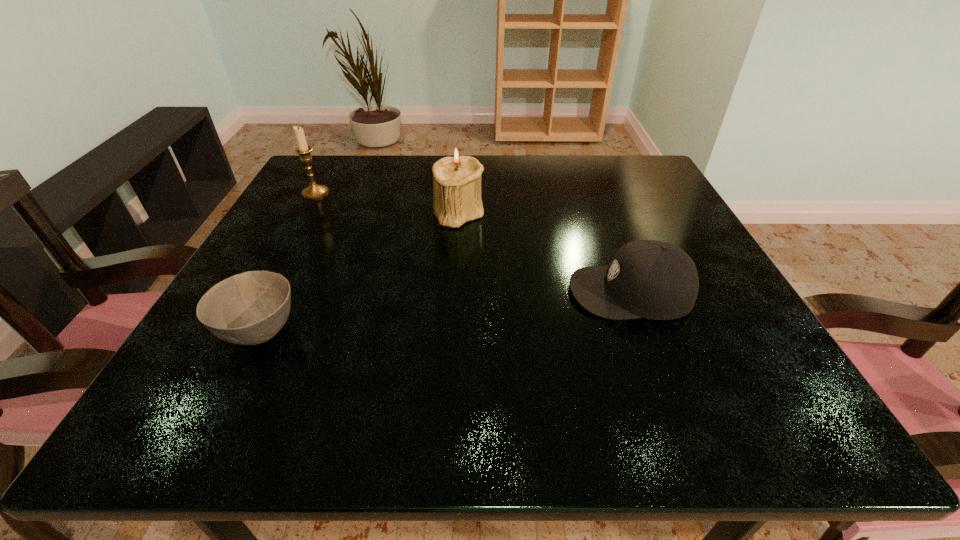
You are a GUI agent. You are given a task and a screenshot of the screen. Output one action in this format:
    pyautogui.click(x=<x>, y=<y>)
    Task: Click on the left candle_holder
    
    Given the screenshot: What is the action you would take?
    pyautogui.click(x=314, y=191)

Where is `the right candle_holder`? the right candle_holder is located at coordinates (457, 199).

Identify the location of the rightmost object. [x=651, y=279].

At what (x,y) coordinates should I click in order to perform the action: click on cap. Please return your answer as a coordinate pair (x, y). Looking at the image, I should click on (651, 279).

The height and width of the screenshot is (540, 960). What are the coordinates of `the shortest object` in the screenshot? It's located at (250, 308).

Where is `free space located 0.060m on the back of the left candle_holder`? free space located 0.060m on the back of the left candle_holder is located at coordinates (325, 174).

This screenshot has width=960, height=540. In order to click on blank space located 0.370m on the front of the right candle_holder in this screenshot , I will do `click(446, 373)`.

At what (x,y) coordinates should I click in order to perform the action: click on vacant area situated on the front-facing side of the cap. Please return your answer as a coordinate pair (x, y). Looking at the image, I should click on (485, 291).

Locate an element on the screen. The image size is (960, 540). blank area located 0.270m on the front-facing side of the cap is located at coordinates (418, 291).

I want to click on free region located on the front-facing side of the cap, so click(x=423, y=291).